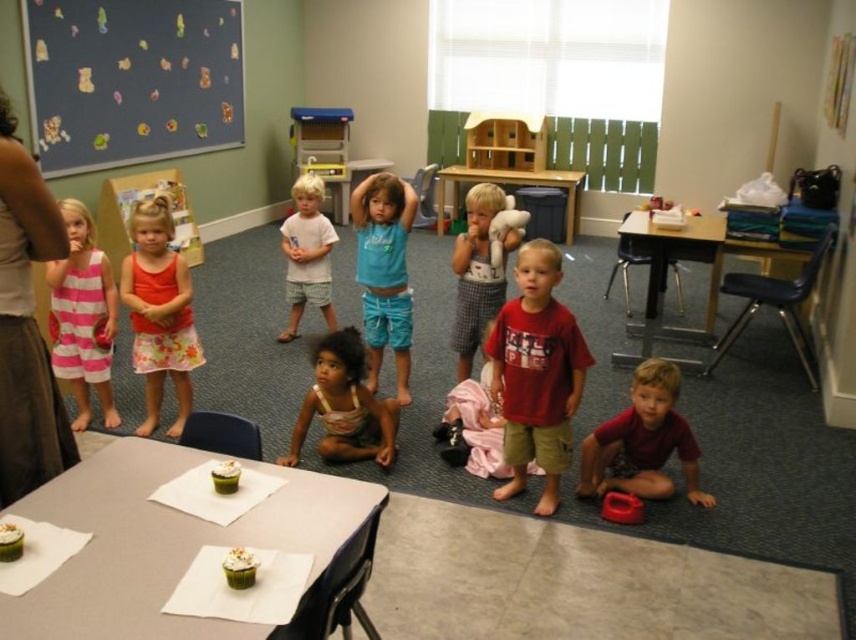
Question: Among these objects, which one is farthest from the camera?

Choices:
 (A) red matte shirt at center
 (B) floral skirt at center
 (C) matte red shirt at lower right
 (D) blue felt bulletin board at upper left

Answer: (D)

Question: Does striped cotton dress at left appear over light brown cotton shirt at center?

Choices:
 (A) yes
 (B) no

Answer: (B)

Question: Which object is the closest to the floral skirt at center?

Choices:
 (A) brown textured skirt at left
 (B) light brown cotton shorts at center

Answer: (B)

Question: Does brown textured skirt at left appear on the left side of light brown cotton shirt at center?

Choices:
 (A) yes
 (B) no

Answer: (A)

Question: Considering the real-world distances, which object is farthest from the red matte shirt at center?

Choices:
 (A) floral skirt at center
 (B) matte red shirt at lower right
 (C) light brown cotton shorts at center
 (D) blue felt bulletin board at upper left

Answer: (D)

Question: Can you confirm if blue felt bulletin board at upper left is wider than matte red shirt at lower right?

Choices:
 (A) no
 (B) yes

Answer: (B)